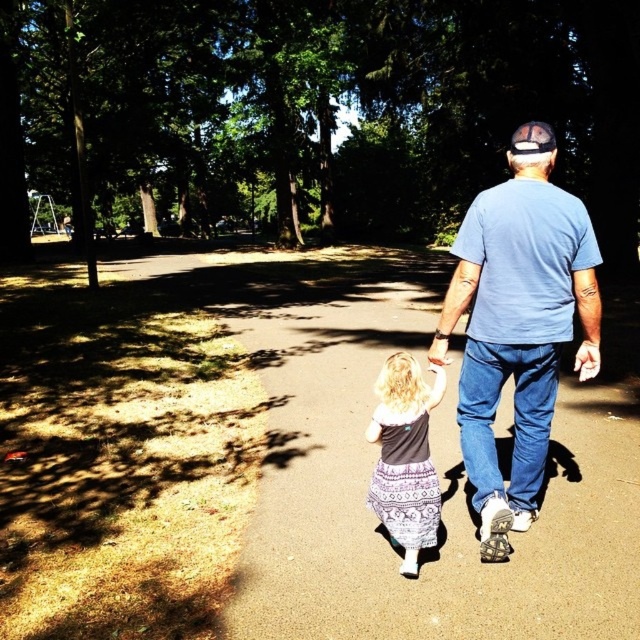
Is point (536, 403) behind point (394, 540)?

No.

Which is more to the right, blue cotton t-shirt at center or patterned fabric dress at center?

Positioned to the right is blue cotton t-shirt at center.

Who is more distant from viewer, (488,371) or (428,394)?

Point (488,371)

You are a GUI agent. You are given a task and a screenshot of the screen. Output one action in this format:
    pyautogui.click(x=<x>, y=<y>)
    Task: Click on the blue cotton t-shirt at center
    The width and height of the screenshot is (640, 640).
    Given the screenshot: What is the action you would take?
    pyautogui.click(x=516, y=332)

Can you confirm if patterned fabric dress at center is wider than white fabric baseball cap at upper center?

No, patterned fabric dress at center is not wider than white fabric baseball cap at upper center.

Locate an element on the screen. patterned fabric dress at center is located at coordinates (404, 456).

This screenshot has height=640, width=640. I want to click on patterned fabric dress at center, so click(404, 456).

Who is shorter, smooth asphalt path at center or blue cotton t-shirt at center?

With less height is smooth asphalt path at center.

Is smooth asphalt path at center bigger than blue cotton t-shirt at center?

Yes, smooth asphalt path at center is bigger than blue cotton t-shirt at center.

Which is behind, point (406, 340) or point (545, 406)?

The point (406, 340) is more distant.

You are a GUI agent. You are given a task and a screenshot of the screen. Output one action in this format:
    pyautogui.click(x=<x>, y=<y>)
    Task: Click on the smooth asphalt path at center
    This screenshot has width=640, height=640.
    Given the screenshot: What is the action you would take?
    pyautogui.click(x=435, y=465)